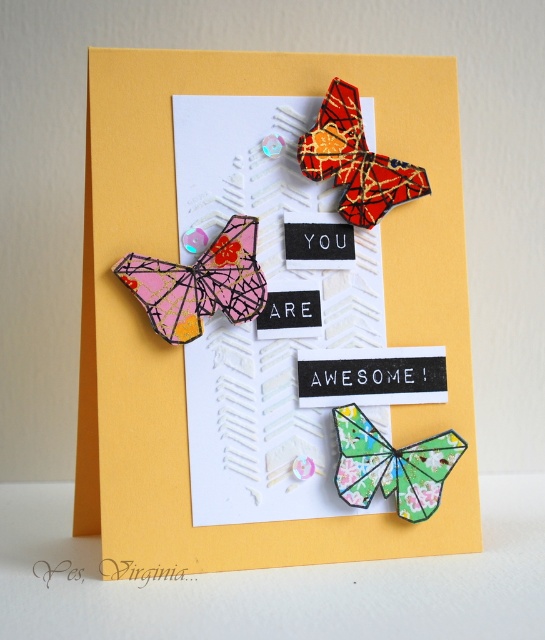
You are designing a greeting card and want to ensure the metallic gold butterfly at upper center and the green textured paper butterfly at center are arranged properly. Based on the image, which butterfly is positioned higher on the card?

The metallic gold butterfly at upper center is positioned higher on the card than the green textured paper butterfly at center.

You need to place a green textured paper butterfly at center onto a yellow paper card at upper center. Based on the scene description, will the butterfly fit entirely within the card?

The yellow paper card at upper center is wider than the green textured paper butterfly at center, so the butterfly will fit entirely within the card.

You are designing a greeting card and need to ensure the green textured paper butterfly at center is visible against the yellow paper card at upper center. Based on their sizes, will the butterfly be easily noticeable?

The yellow paper card at upper center is taller than the green textured paper butterfly at center, so the butterfly will be easily noticeable as it is smaller and positioned on a contrasting background.